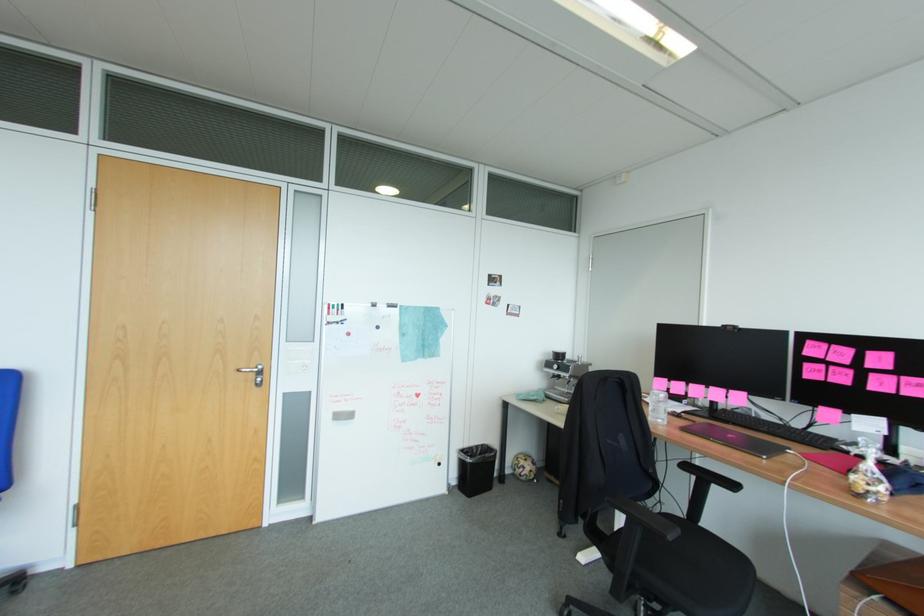
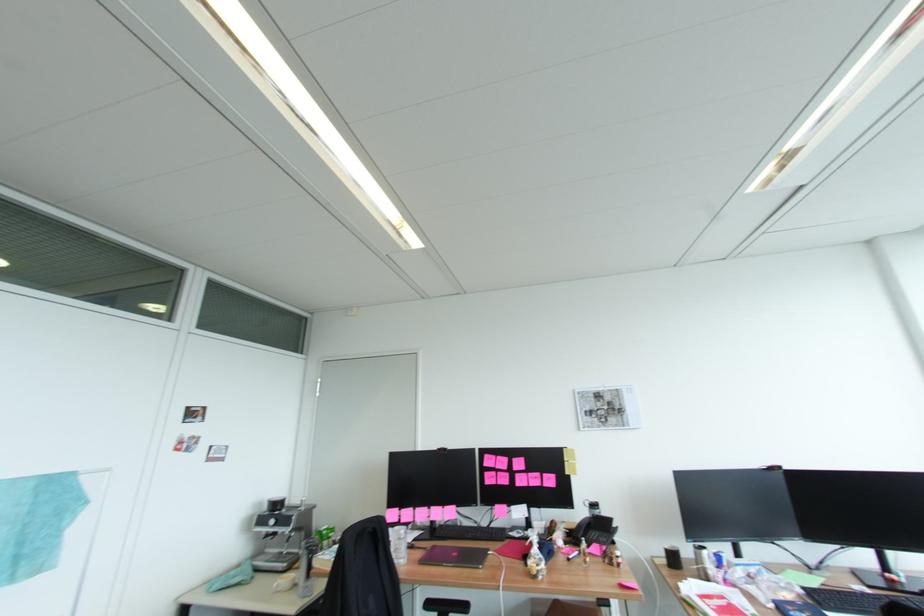
Find the pixel in the second image that matches [881,493] in the first image.

(546, 570)